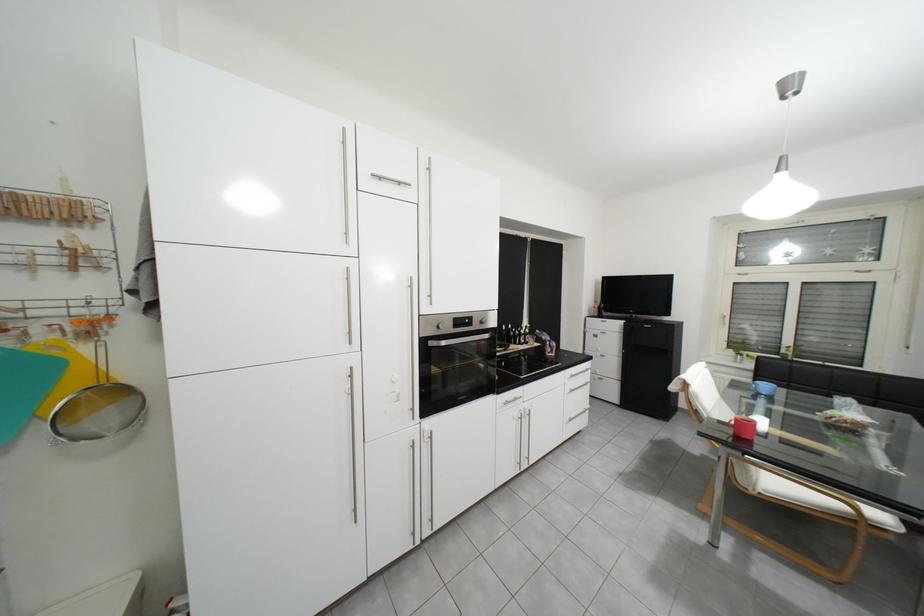
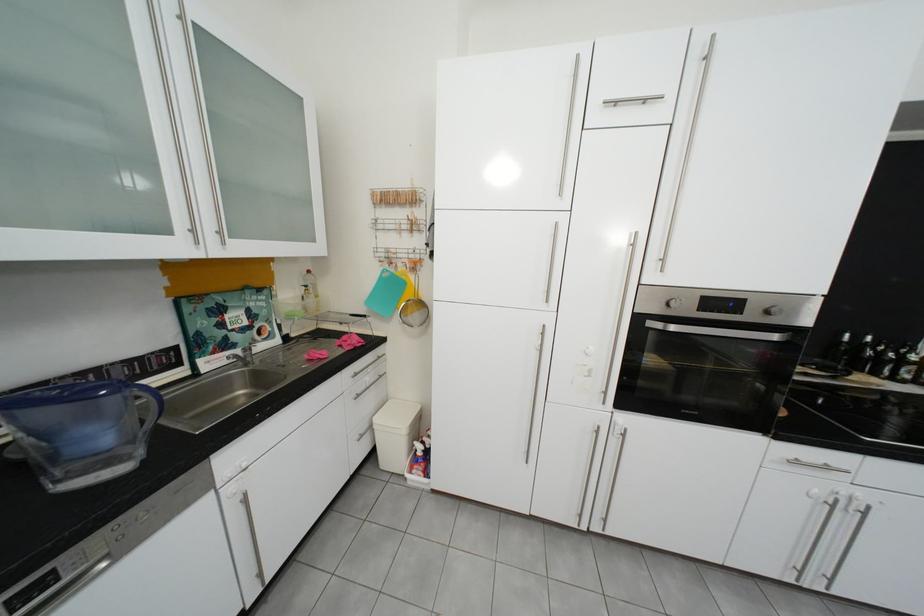
In the second image, find the point that corresponds to pixel 43 350 in the first image.

(409, 275)